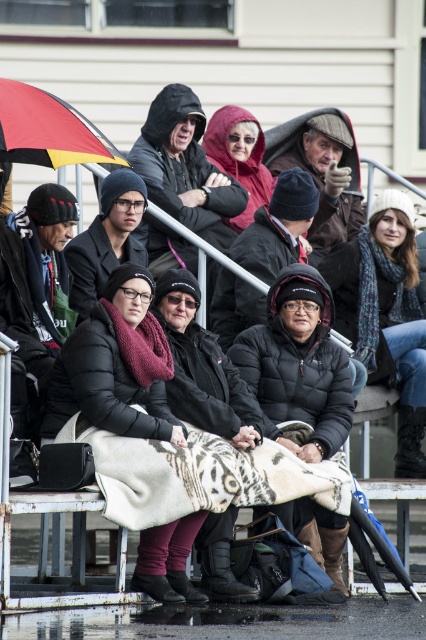
You are a photographer standing at the camera position. You want to take a closeup shot of the black quilted jacket at lower center. Can you get a clear closeup shot of it without zooming in?

The black quilted jacket at lower center is 70.01 meters from camera, so no, you cannot get a clear closeup shot of it without zooming in because it is too far away.